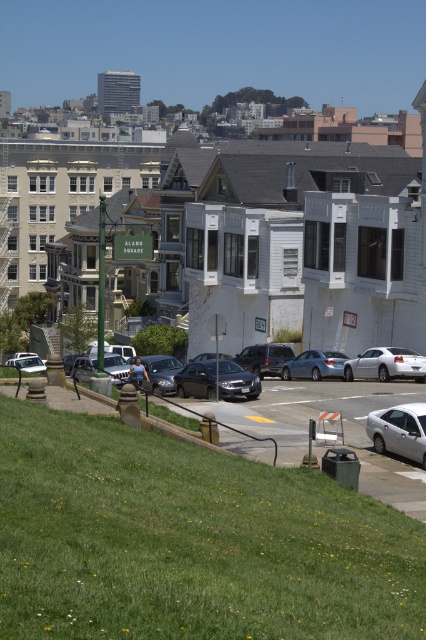
Can you confirm if shiny black sedan at center is positioned above satin silver sedan at center?

Incorrect, shiny black sedan at center is not positioned above satin silver sedan at center.

Can you confirm if shiny black sedan at center is thinner than satin silver sedan at center?

Correct, shiny black sedan at center's width is less than satin silver sedan at center's.

Identify the location of shiny black sedan at center. (196, 380).

Based on the photo, between satin silver sedan at center and white glossy sedan at lower left, which one is positioned higher?

satin silver sedan at center is above.

Measure the distance between satin silver sedan at center and camera.

They are 50.53 meters apart.

Which is in front, point (302, 362) or point (36, 356)?

Point (302, 362)

Identify the location of satin silver sedan at center. The width and height of the screenshot is (426, 640). (314, 364).

Looking at this image, can you confirm if green grass at lower left is smaller than satin black suv at center?

Incorrect, green grass at lower left is not smaller in size than satin black suv at center.

Who is shorter, green grass at lower left or satin black suv at center?

satin black suv at center

Who is more forward, (360, 550) or (264, 349)?

Point (360, 550)

Where is `green grass at lower left`? green grass at lower left is located at coordinates (189, 541).